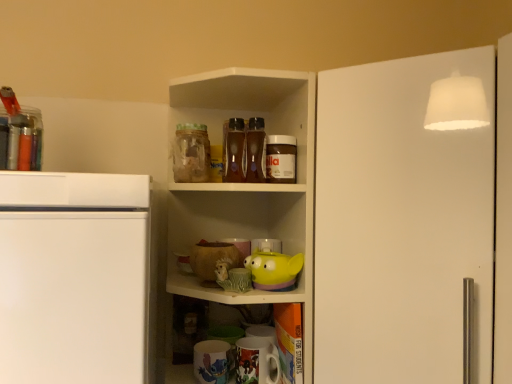
Question: Is white matte door at upper right wider or thinner than matte green ceramic mug at center, positioned as the 2th toy in right-to-left order?

Choices:
 (A) thin
 (B) wide

Answer: (B)

Question: From a real-world perspective, is white matte door at upper right above or below matte green ceramic mug at center, positioned as the first toy in left-to-right order?

Choices:
 (A) below
 (B) above

Answer: (B)

Question: Based on their relative distances, which object is nearer to the matte green ceramic mug at center, positioned as the first toy in left-to-right order?

Choices:
 (A) transparent glass jar at upper center, marked as the 2th beverage in a right-to-left arrangement
 (B) white matte door at upper right
 (C) matte ceramic mug at lower center, which appears as the 2th appliance when viewed from the left
 (D) yellow rubber duck at center, arranged as the 2th toy when viewed from the left
 (E) matte ceramic mug at lower center, arranged as the second appliance when viewed from the right

Answer: (D)

Question: Which object is the farthest from the transparent glass jar at upper center, which appears as the 1th beverage when viewed from the left?

Choices:
 (A) white matte door at upper right
 (B) matte ceramic mug at lower center, which appears as the 2th appliance when viewed from the left
 (C) matte ceramic mug at lower center, arranged as the second appliance when viewed from the right
 (D) yellow rubber duck at center, the 1th toy from the right
 (E) matte green ceramic mug at center, positioned as the 2th toy in right-to-left order

Answer: (B)